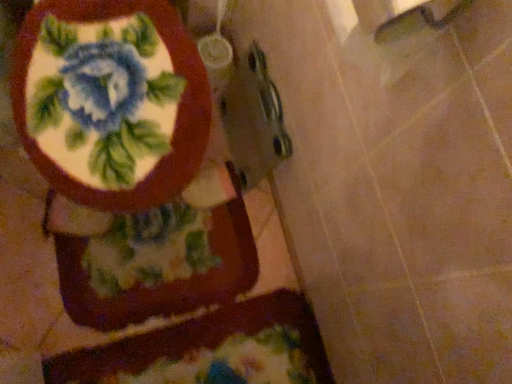
Question: Does fluffy multicolored bath mat at lower center come behind matte ceramic toilet at upper left?

Choices:
 (A) no
 (B) yes

Answer: (B)

Question: Is the depth of fluffy multicolored bath mat at lower center less than that of matte ceramic toilet at upper left?

Choices:
 (A) no
 (B) yes

Answer: (A)

Question: Would you say fluffy multicolored bath mat at lower center contains matte ceramic toilet at upper left?

Choices:
 (A) yes
 (B) no

Answer: (B)

Question: Considering the relative sizes of fluffy multicolored bath mat at lower center and matte ceramic toilet at upper left in the image provided, is fluffy multicolored bath mat at lower center thinner than matte ceramic toilet at upper left?

Choices:
 (A) yes
 (B) no

Answer: (A)

Question: Does fluffy multicolored bath mat at lower center have a greater width compared to matte ceramic toilet at upper left?

Choices:
 (A) yes
 (B) no

Answer: (B)

Question: From a real-world perspective, does fluffy multicolored bath mat at lower center stand above matte ceramic toilet at upper left?

Choices:
 (A) no
 (B) yes

Answer: (A)

Question: Is matte ceramic toilet at upper left looking in the opposite direction of fluffy multicolored bath mat at lower center?

Choices:
 (A) no
 (B) yes

Answer: (A)

Question: From the image's perspective, is matte ceramic toilet at upper left beneath fluffy multicolored bath mat at lower center?

Choices:
 (A) no
 (B) yes

Answer: (A)

Question: From the image's perspective, would you say matte ceramic toilet at upper left is positioned over fluffy multicolored bath mat at lower center?

Choices:
 (A) no
 (B) yes

Answer: (B)

Question: Can you confirm if matte ceramic toilet at upper left is thinner than fluffy multicolored bath mat at lower center?

Choices:
 (A) yes
 (B) no

Answer: (B)

Question: Considering the relative positions of matte ceramic toilet at upper left and fluffy multicolored bath mat at lower center in the image provided, is matte ceramic toilet at upper left to the left of fluffy multicolored bath mat at lower center from the viewer's perspective?

Choices:
 (A) yes
 (B) no

Answer: (A)

Question: Is matte ceramic toilet at upper left outside fluffy multicolored bath mat at lower center?

Choices:
 (A) yes
 (B) no

Answer: (A)

Question: Considering the relative positions of matte ceramic toilet at upper left and fluffy multicolored bath mat at lower center in the image provided, is matte ceramic toilet at upper left to the left or to the right of fluffy multicolored bath mat at lower center?

Choices:
 (A) right
 (B) left

Answer: (B)